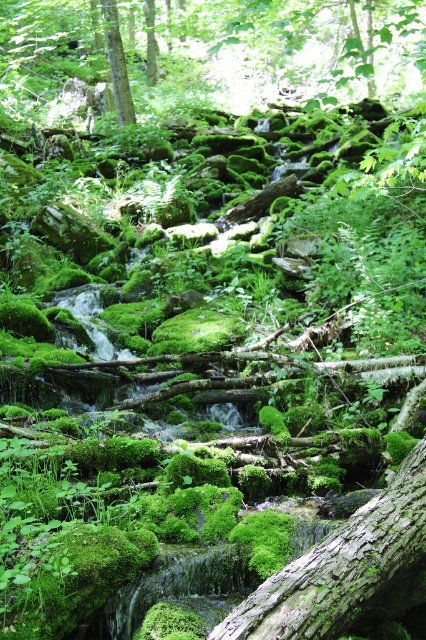
In the scene shown: Who is lower down, green mossy log at center or green mossy tree at upper center?

green mossy log at center is lower down.

Does green mossy log at center have a larger size compared to green mossy tree at upper center?

No.

Locate an element on the screen. The height and width of the screenshot is (640, 426). green mossy log at center is located at coordinates (339, 566).